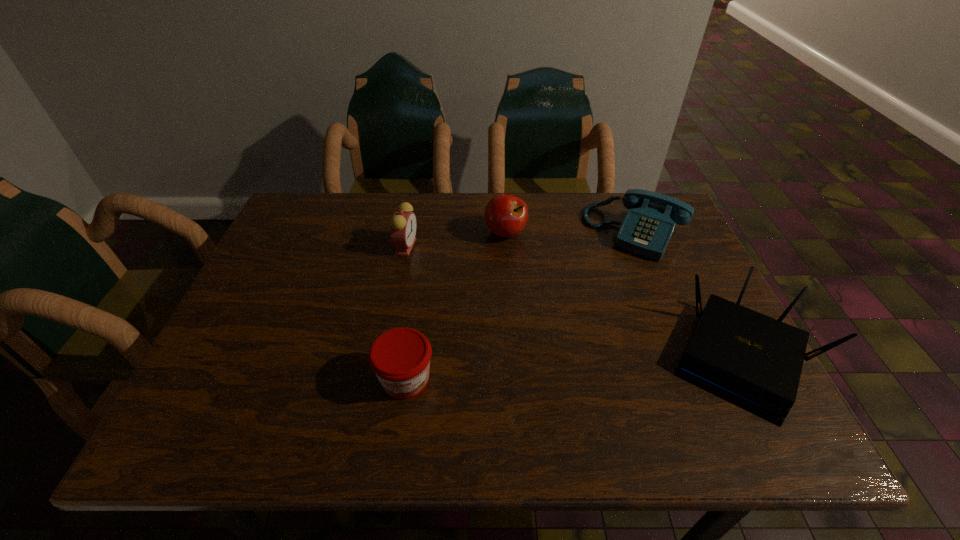
Find the location of `blank space located 0.300m on the stem of the third object from right to left`. blank space located 0.300m on the stem of the third object from right to left is located at coordinates (527, 332).

Locate an element on the screen. The height and width of the screenshot is (540, 960). vacant space located 0.220m on the stem of the third object from right to left is located at coordinates (521, 306).

Identify the location of vacant area situated on the dial of the telephone. The width and height of the screenshot is (960, 540). (565, 349).

Identify the location of free location located 0.270m on the dial of the telephone. Image resolution: width=960 pixels, height=540 pixels. (580, 325).

Find the location of a particular element. The image size is (960, 540). vacant space positioned on the dial of the telephone is located at coordinates (580, 325).

Where is `alarm clock present at the far edge`? The height and width of the screenshot is (540, 960). alarm clock present at the far edge is located at coordinates (403, 224).

Find the location of a particular element. The height and width of the screenshot is (540, 960). apple situated at the far edge is located at coordinates (506, 215).

Locate an element on the screen. Image resolution: width=960 pixels, height=540 pixels. telephone present at the far edge is located at coordinates (646, 230).

At what (x,y) coordinates should I click in order to perform the action: click on jam present at the near edge. Please return your answer as a coordinate pair (x, y). Looking at the image, I should click on (400, 357).

Identify the location of router at the near edge. (753, 361).